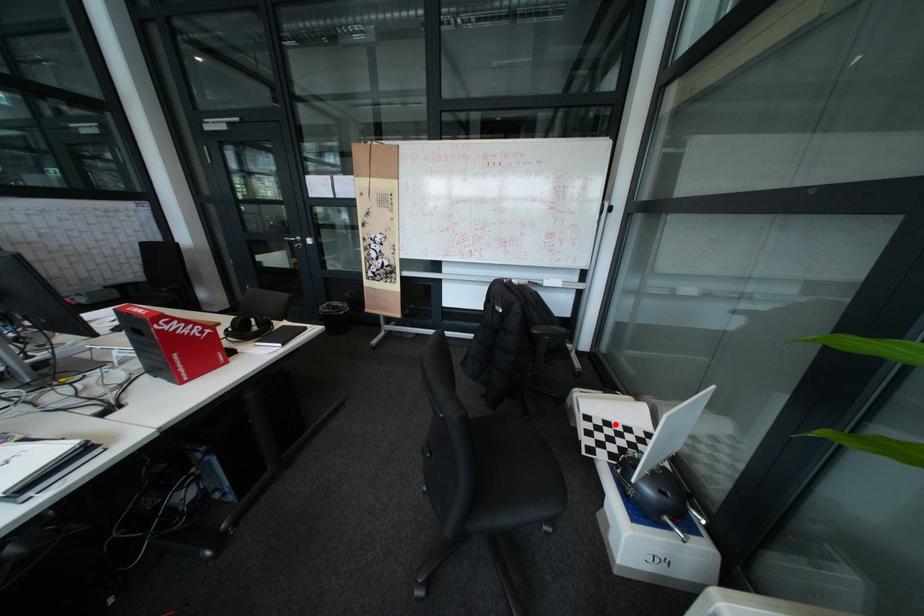
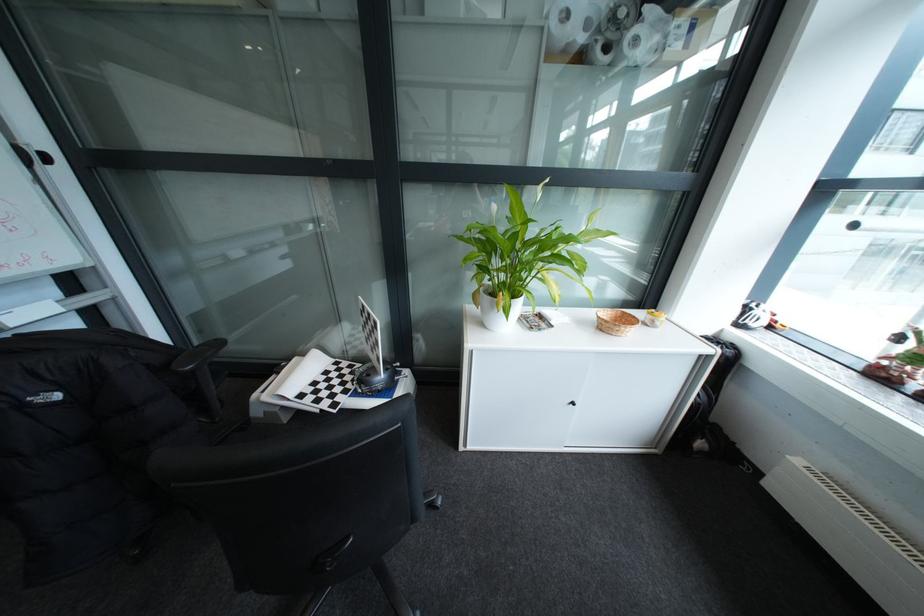
Where in the second image is the point corresponding to the highlighted location from the first image?

(325, 389)